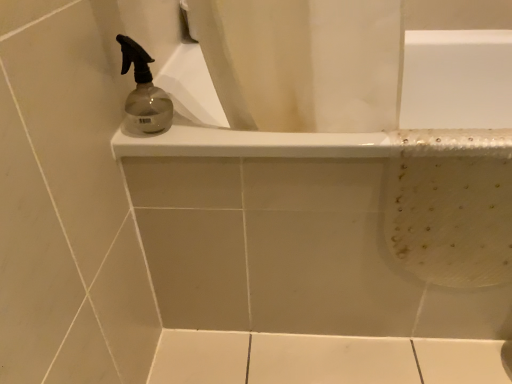
This screenshot has width=512, height=384. I want to click on transparent glass spray bottle at upper left, so click(x=143, y=92).

In order to face transparent glass spray bottle at upper left, should I rotate leftwards or rightwards?

To face it directly, rotate left by 15.077 degrees.

What do you see at coordinates (143, 92) in the screenshot? Image resolution: width=512 pixels, height=384 pixels. I see `transparent glass spray bottle at upper left` at bounding box center [143, 92].

What is the approximate width of transparent glass spray bottle at upper left?

The width of transparent glass spray bottle at upper left is 3.88 inches.

Find the location of a particular element. white glossy bathtub at upper center is located at coordinates (321, 223).

Describe the element at coordinates (321, 223) in the screenshot. I see `white glossy bathtub at upper center` at that location.

Locate an element on the screen. transparent glass spray bottle at upper left is located at coordinates click(x=143, y=92).

Which is more to the left, transparent glass spray bottle at upper left or white glossy bathtub at upper center?

Positioned to the left is transparent glass spray bottle at upper left.

Which is behind, transparent glass spray bottle at upper left or white glossy bathtub at upper center?

white glossy bathtub at upper center is more distant.

Does point (129, 44) lie in front of point (364, 288)?

Yes, point (129, 44) is in front of point (364, 288).

From the image's perspective, who appears lower, transparent glass spray bottle at upper left or white glossy bathtub at upper center?

white glossy bathtub at upper center.

From a real-world perspective, is transparent glass spray bottle at upper left located higher than white glossy bathtub at upper center?

Yes, from a real-world perspective, transparent glass spray bottle at upper left is over white glossy bathtub at upper center

Which of these two, transparent glass spray bottle at upper left or white glossy bathtub at upper center, is thinner?

transparent glass spray bottle at upper left is thinner.

Which of these two, transparent glass spray bottle at upper left or white glossy bathtub at upper center, stands shorter?

transparent glass spray bottle at upper left.

Who is smaller, transparent glass spray bottle at upper left or white glossy bathtub at upper center?

transparent glass spray bottle at upper left.

Would you say transparent glass spray bottle at upper left contains white glossy bathtub at upper center?

No, white glossy bathtub at upper center is located outside of transparent glass spray bottle at upper left.

Are transparent glass spray bottle at upper left and white glossy bathtub at upper center located far from each other?

No, transparent glass spray bottle at upper left is not far from white glossy bathtub at upper center.

Could you tell me if transparent glass spray bottle at upper left is turned towards white glossy bathtub at upper center?

No, transparent glass spray bottle at upper left is not aimed at white glossy bathtub at upper center.

Could you measure the distance between transparent glass spray bottle at upper left and white glossy bathtub at upper center?

13.99 inches.

This screenshot has width=512, height=384. In order to click on bathtub below the transparent glass spray bottle at upper left (from the image's perspective) in this screenshot , I will do `click(321, 223)`.

Which is more to the right, white glossy bathtub at upper center or transparent glass spray bottle at upper left?

From the viewer's perspective, white glossy bathtub at upper center appears more on the right side.

Which object is closer to the camera, white glossy bathtub at upper center or transparent glass spray bottle at upper left?

transparent glass spray bottle at upper left is closer to the camera.

Which is behind, point (456, 288) or point (142, 63)?

Positioned behind is point (456, 288).

From the image's perspective, is white glossy bathtub at upper center located above or below transparent glass spray bottle at upper left?

Clearly, from the image's perspective, white glossy bathtub at upper center is below transparent glass spray bottle at upper left.

From a real-world perspective, which is physically below, white glossy bathtub at upper center or transparent glass spray bottle at upper left?

In real-world perspective, white glossy bathtub at upper center is lower.

Which object is wider, white glossy bathtub at upper center or transparent glass spray bottle at upper left?

white glossy bathtub at upper center.

Between white glossy bathtub at upper center and transparent glass spray bottle at upper left, which one has less height?

Standing shorter between the two is transparent glass spray bottle at upper left.

Based on the photo, can you confirm if white glossy bathtub at upper center is smaller than transparent glass spray bottle at upper left?

No.

Is white glossy bathtub at upper center inside or outside of transparent glass spray bottle at upper left?

white glossy bathtub at upper center exists outside the volume of transparent glass spray bottle at upper left.

Is there a large distance between white glossy bathtub at upper center and transparent glass spray bottle at upper left?

No, there isn't a large distance between white glossy bathtub at upper center and transparent glass spray bottle at upper left.

Is white glossy bathtub at upper center turned away from transparent glass spray bottle at upper left?

No, transparent glass spray bottle at upper left is not at the back of white glossy bathtub at upper center.

The width and height of the screenshot is (512, 384). I want to click on soap dispenser on the left side of white glossy bathtub at upper center, so click(x=143, y=92).

This screenshot has width=512, height=384. I want to click on bathtub behind the transparent glass spray bottle at upper left, so click(321, 223).

I want to click on bathtub lying below the transparent glass spray bottle at upper left (from the image's perspective), so click(x=321, y=223).